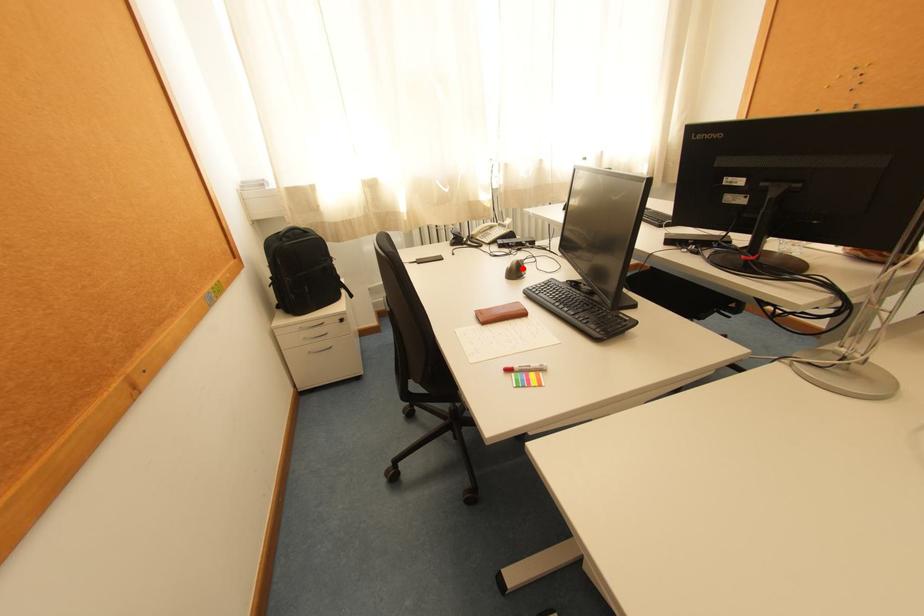
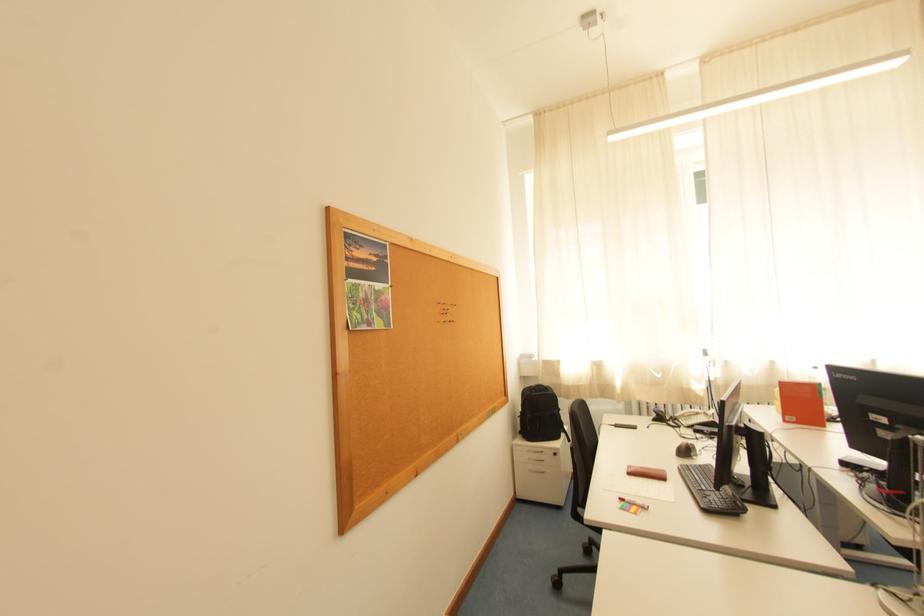
In the second image, find the point that corresponds to the highlighted location in the first image.

(691, 448)